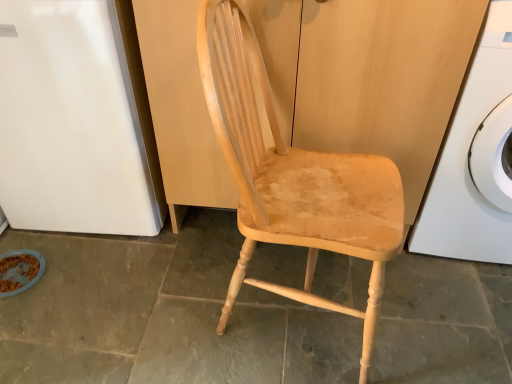
Question: From their relative heights in the image, would you say white glossy washing machine at right is taller or shorter than white glossy refrigerator at left?

Choices:
 (A) tall
 (B) short

Answer: (A)

Question: Choose the correct answer: Is white glossy washing machine at right inside white glossy refrigerator at left or outside it?

Choices:
 (A) inside
 (B) outside

Answer: (B)

Question: Which object is the farthest from the white glossy refrigerator at left?

Choices:
 (A) natural wood chair at center
 (B) natural wood dresser at center
 (C) white glossy washing machine at right
 (D) brown crumbly food at lower left

Answer: (C)

Question: Which object is positioned farthest from the brown crumbly food at lower left?

Choices:
 (A) white glossy refrigerator at left
 (B) white glossy washing machine at right
 (C) natural wood chair at center
 (D) natural wood dresser at center

Answer: (B)